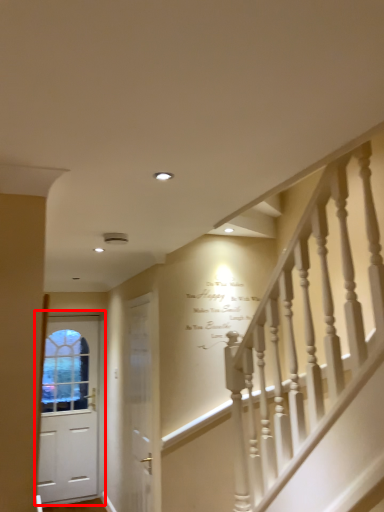
Question: Observing the image, what is the correct spatial positioning of door (annotated by the red box) in reference to door?

Choices:
 (A) left
 (B) right

Answer: (A)